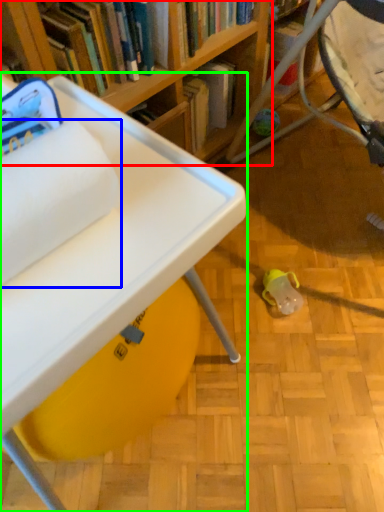
Question: Which is farther away from bookcase (highlighted by a red box)? toilet paper (highlighted by a blue box) or table (highlighted by a green box)?

Choices:
 (A) toilet paper
 (B) table

Answer: (A)